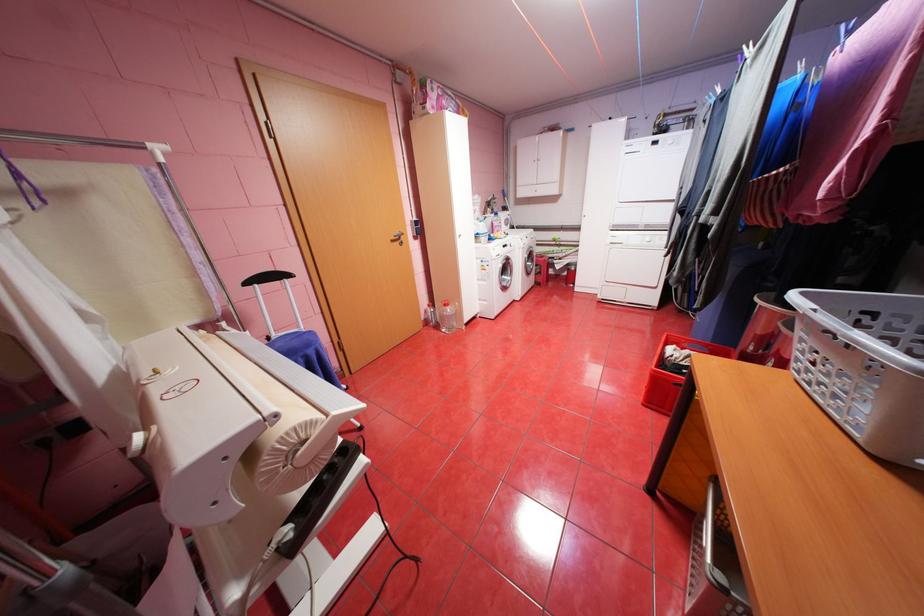
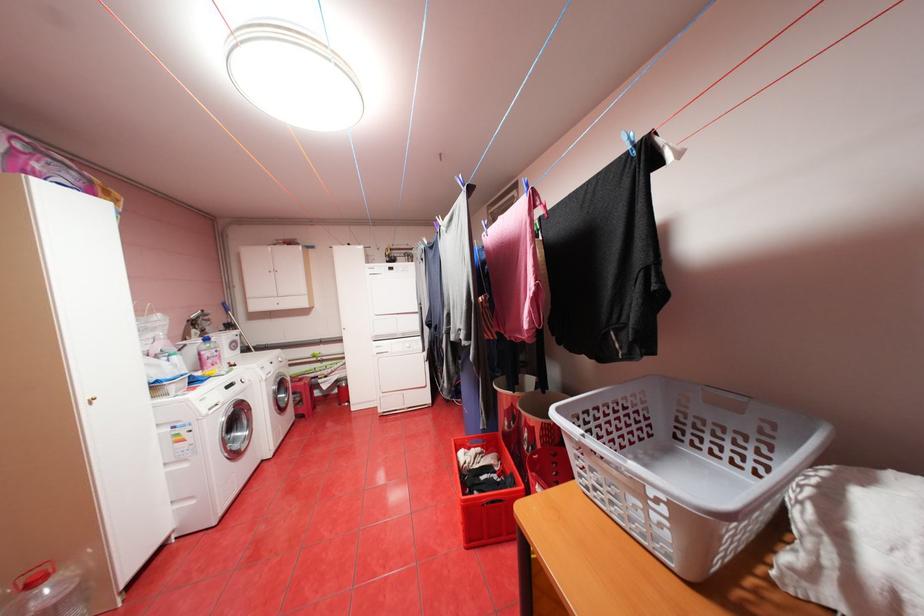
Find the pixel in the second image that matches [551,256] in the first image.

(310, 379)